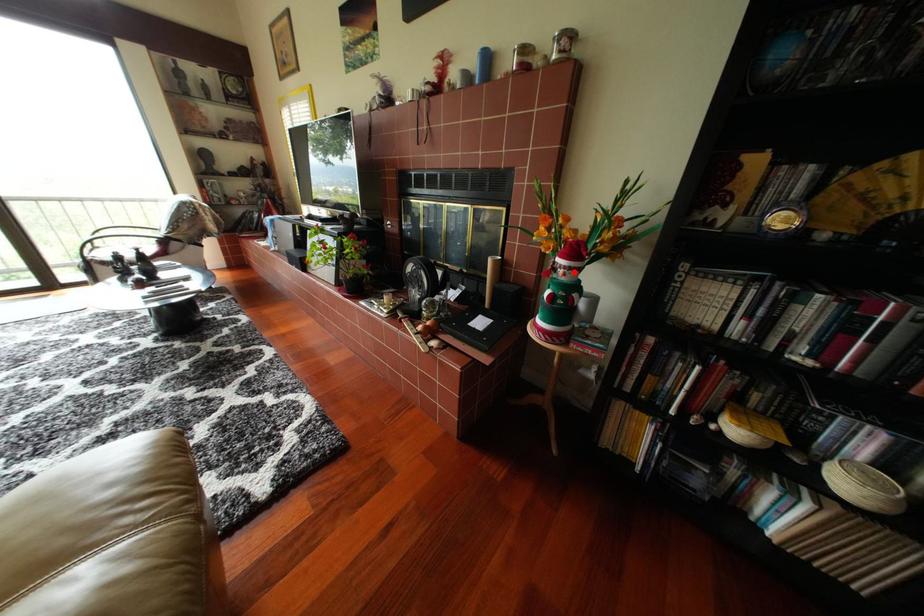
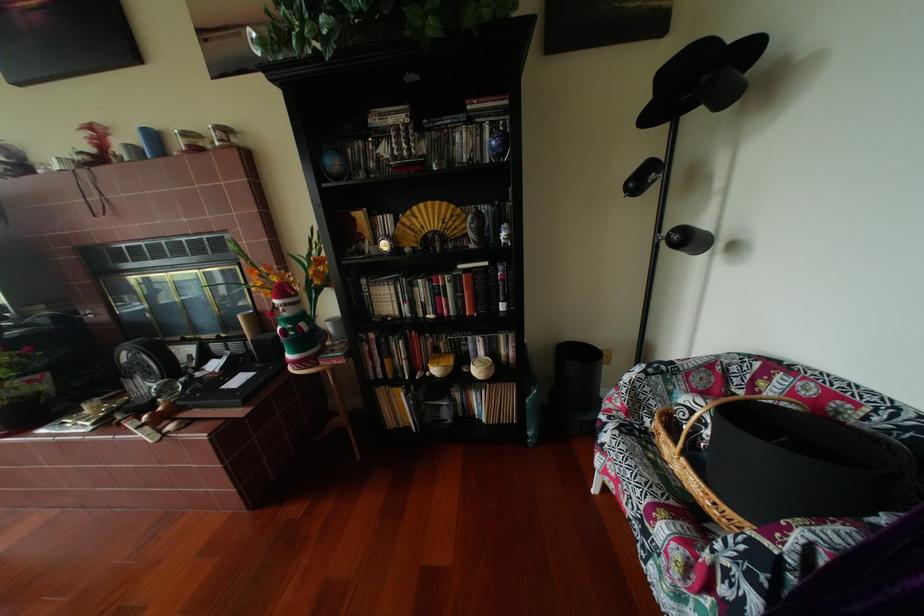
In the second image, find the point that corresponds to the highlighted location in the first image.

(294, 310)